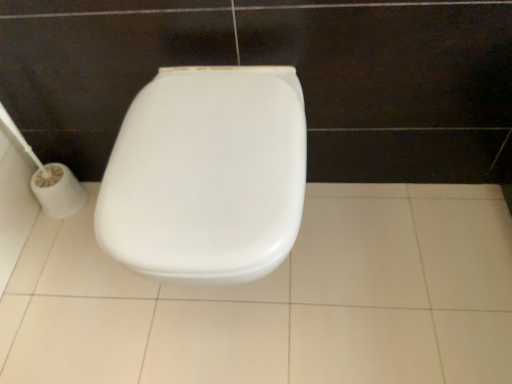
Question: Does white plastic toilet paper at left have a lesser height compared to white glossy tile at center?

Choices:
 (A) no
 (B) yes

Answer: (A)

Question: Is white plastic toilet paper at left to the left of white glossy tile at center from the viewer's perspective?

Choices:
 (A) no
 (B) yes

Answer: (B)

Question: From a real-world perspective, is white plastic toilet paper at left located beneath white glossy tile at center?

Choices:
 (A) no
 (B) yes

Answer: (A)

Question: Is white plastic toilet paper at left not inside white glossy tile at center?

Choices:
 (A) yes
 (B) no

Answer: (A)

Question: Is white plastic toilet paper at left turned away from white glossy tile at center?

Choices:
 (A) yes
 (B) no

Answer: (B)

Question: From the image's perspective, would you say white plastic toilet paper at left is shown under white glossy tile at center?

Choices:
 (A) yes
 (B) no

Answer: (B)

Question: Is white plastic toilet paper at left to the right of white plastic toilet at center from the viewer's perspective?

Choices:
 (A) no
 (B) yes

Answer: (A)

Question: Would you consider white plastic toilet paper at left to be distant from white plastic toilet at center?

Choices:
 (A) no
 (B) yes

Answer: (A)

Question: Is white plastic toilet paper at left at the left side of white plastic toilet at center?

Choices:
 (A) yes
 (B) no

Answer: (A)

Question: Would you say white plastic toilet paper at left is outside white plastic toilet at center?

Choices:
 (A) no
 (B) yes

Answer: (B)

Question: Is the position of white plastic toilet paper at left more distant than that of white plastic toilet at center?

Choices:
 (A) yes
 (B) no

Answer: (A)

Question: Considering the relative positions of white plastic toilet paper at left and white plastic toilet at center in the image provided, is white plastic toilet paper at left in front of white plastic toilet at center?

Choices:
 (A) yes
 (B) no

Answer: (B)

Question: Is white glossy tile at center turned away from white plastic toilet paper at left?

Choices:
 (A) yes
 (B) no

Answer: (B)